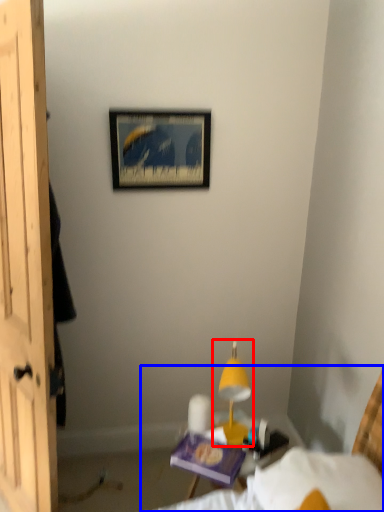
Question: Which point is further to the camera, table lamp (highlighted by a red box) or bed (highlighted by a blue box)?

Choices:
 (A) table lamp
 (B) bed

Answer: (A)